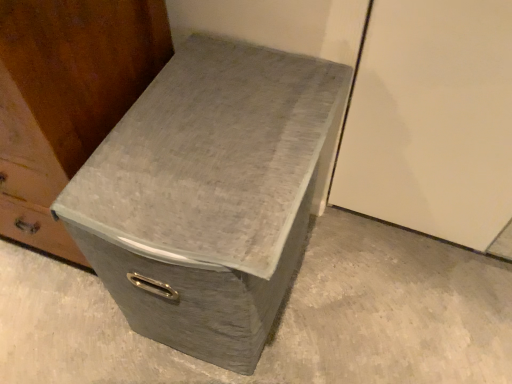
Locate an element on the screen. free location to the right of gray fabric shoe box at center is located at coordinates (377, 289).